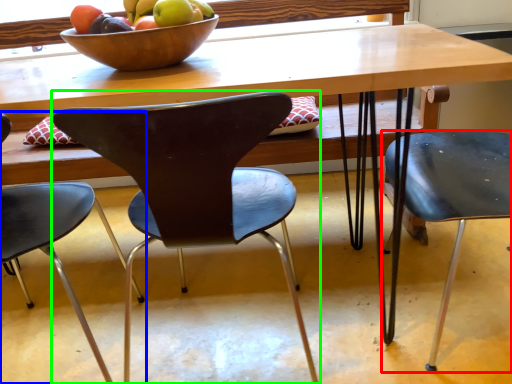
Question: Estimate the real-world distances between objects in this image. Which object is closer to chair (highlighted by a red box), chair (highlighted by a blue box) or chair (highlighted by a green box)?

Choices:
 (A) chair
 (B) chair

Answer: (B)